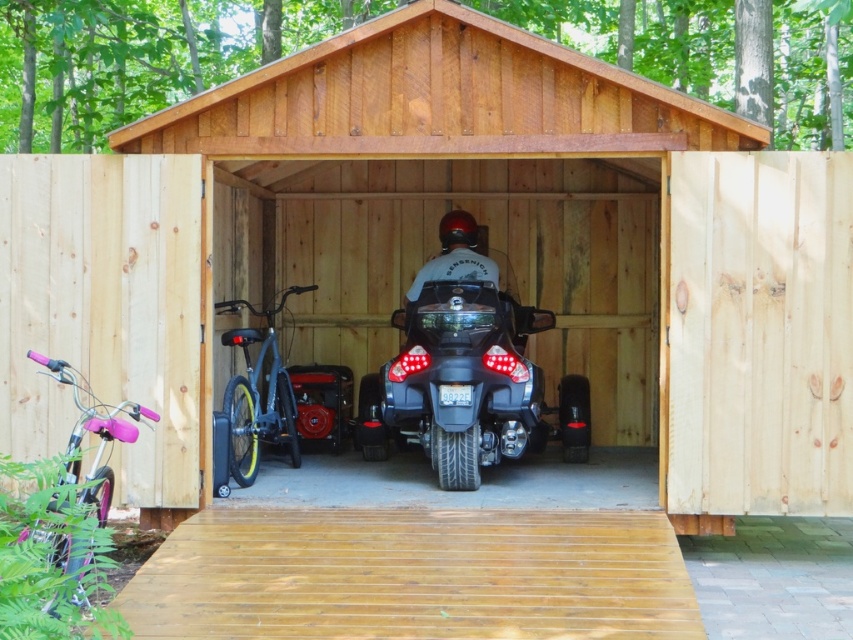
Question: Among these points, which one is nearest to the camera?

Choices:
 (A) (x=515, y=381)
 (B) (x=74, y=400)

Answer: (B)

Question: Is black matte trike at center further to camera compared to pink metallic bicycle at lower left?

Choices:
 (A) no
 (B) yes

Answer: (B)

Question: Which of the following is the closest to the observer?

Choices:
 (A) (601, 77)
 (B) (105, 444)
 (C) (784, 349)

Answer: (B)

Question: Which point is farther to the camera?

Choices:
 (A) matte black bicycle at center
 (B) wooden shed at center
 (C) pink metallic bicycle at lower left

Answer: (B)

Question: Is pink metallic bicycle at lower left bigger than matte black bicycle at center?

Choices:
 (A) yes
 (B) no

Answer: (A)

Question: Does natural wood garage door at center have a lesser width compared to pink metallic bicycle at lower left?

Choices:
 (A) yes
 (B) no

Answer: (B)